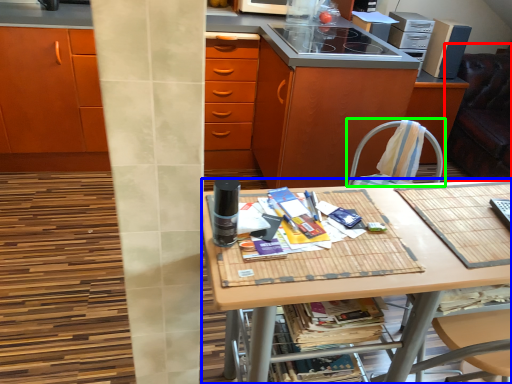
Question: Based on their relative distances, which object is farther from swivel chair (highlighted by a red box)? Choose from desk (highlighted by a blue box) and chair (highlighted by a green box).

Choices:
 (A) desk
 (B) chair

Answer: (A)